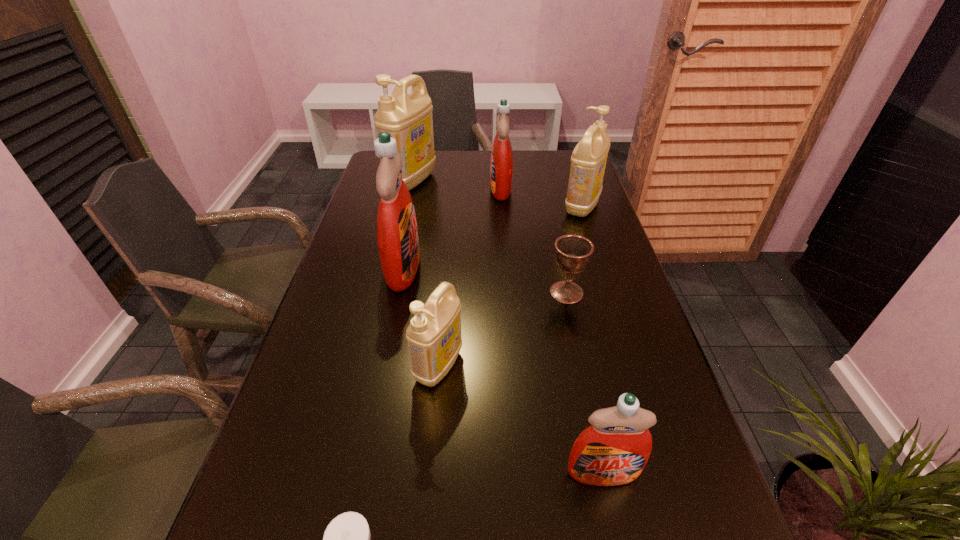
At what (x,y) coordinates should I click in order to perform the action: click on the leftmost beige detergent. Please return your answer as a coordinate pair (x, y). Looking at the image, I should click on (408, 118).

Where is `the leftmost red detergent`? the leftmost red detergent is located at coordinates (397, 234).

Locate an element on the screen. the second farthest red detergent is located at coordinates click(x=397, y=234).

This screenshot has width=960, height=540. Find the location of `the second red detergent from left to right`. the second red detergent from left to right is located at coordinates (501, 163).

Find the location of a particular element. the farthest red detergent is located at coordinates (501, 163).

The width and height of the screenshot is (960, 540). Find the location of `the rightmost beige detergent`. the rightmost beige detergent is located at coordinates pyautogui.click(x=588, y=161).

Find the location of a particular element. the fourth detergent from right to left is located at coordinates (434, 339).

The image size is (960, 540). What are the coordinates of `the fifth object from right to left` in the screenshot? It's located at tap(434, 339).

Image resolution: width=960 pixels, height=540 pixels. In order to click on the rightmost red detergent in this screenshot , I will do `click(614, 450)`.

Locate an element on the screen. the nearest red detergent is located at coordinates (614, 450).